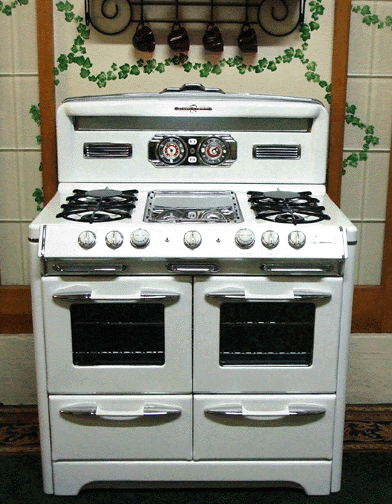
Locate the how you'd open the oven doors in the image. Your answer should be formatted as a list of tuples, i.e. [(x1, y1), (x2, y2), ...], where each tuple contains the x and y coordinates of a point satisfying the conditions above.

[(125, 413), (255, 413), (141, 294), (236, 295)]